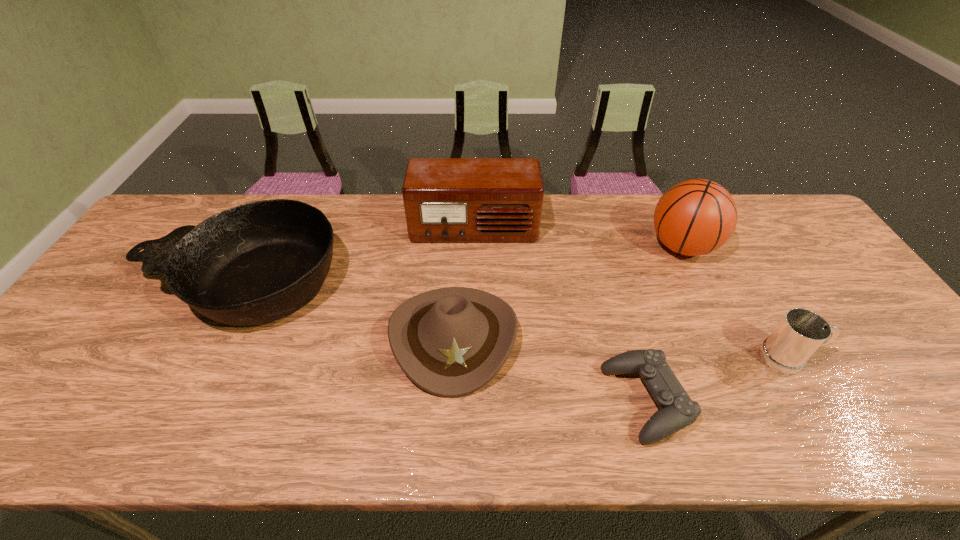
Where is `basketball`? basketball is located at coordinates (695, 217).

Locate an element on the screen. The height and width of the screenshot is (540, 960). radio receiver is located at coordinates (446, 200).

Where is `the leftmost object`? The width and height of the screenshot is (960, 540). the leftmost object is located at coordinates (256, 263).

Identify the location of mug. This screenshot has width=960, height=540. (801, 332).

Find the location of a particular element. cowboy hat is located at coordinates (450, 342).

What are the coordinates of `control` in the screenshot? It's located at (677, 411).

Where is `the shortest object`? This screenshot has width=960, height=540. the shortest object is located at coordinates click(x=677, y=411).

You are a GUI agent. You are given a task and a screenshot of the screen. Output one action in this format:
    pyautogui.click(x=<x>, y=<y>)
    Task: Click on the vacant space located on the front of the basketball
    Image resolution: width=960 pixels, height=540 pixels.
    Given the screenshot: What is the action you would take?
    pyautogui.click(x=721, y=330)

Find the location of a particular element. This screenshot has width=960, height=540. free spot located 0.350m on the front-facing side of the radio receiver is located at coordinates (472, 343).

This screenshot has width=960, height=540. I want to click on free location located with the handle extending from the side of the leftmost object, so [x=115, y=283].